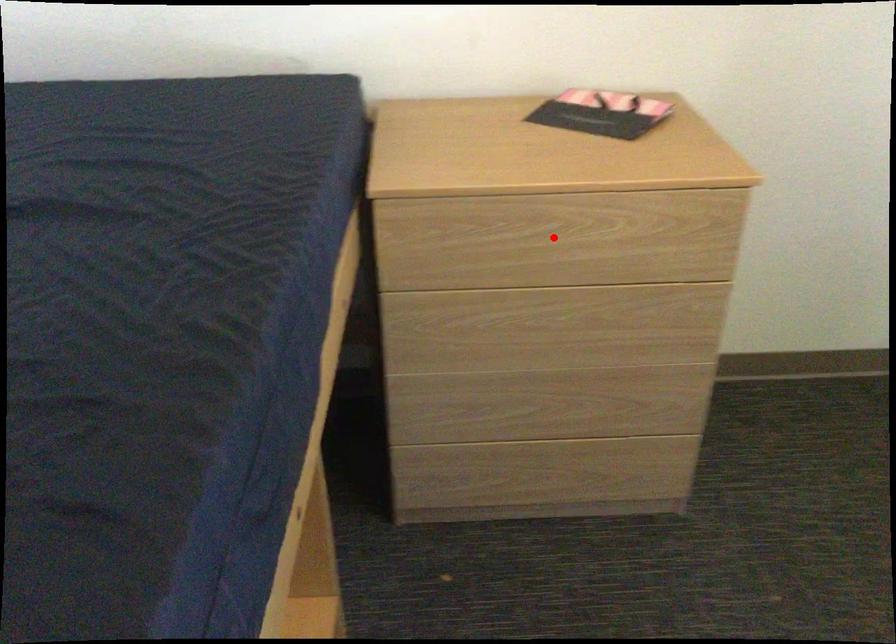
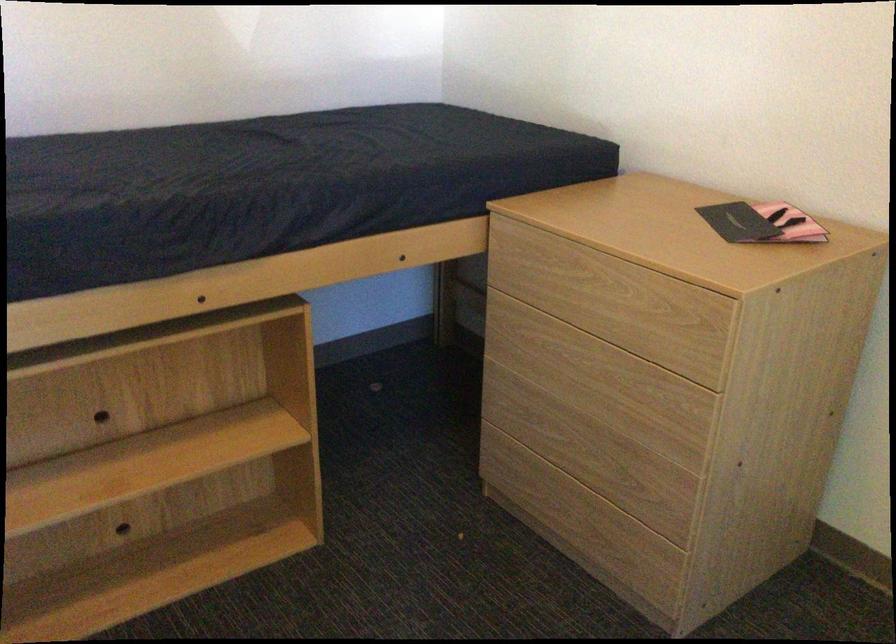
Find the pixel in the second image that matches the highlighted location in the first image.

(582, 287)